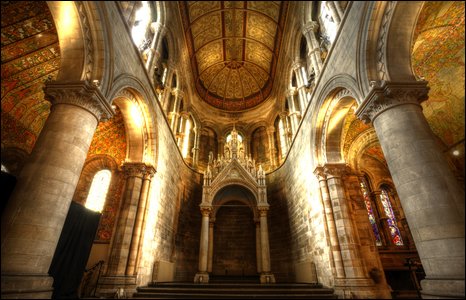
This screenshot has height=300, width=466. Find the location of `entryway`. entryway is located at coordinates (99, 196).